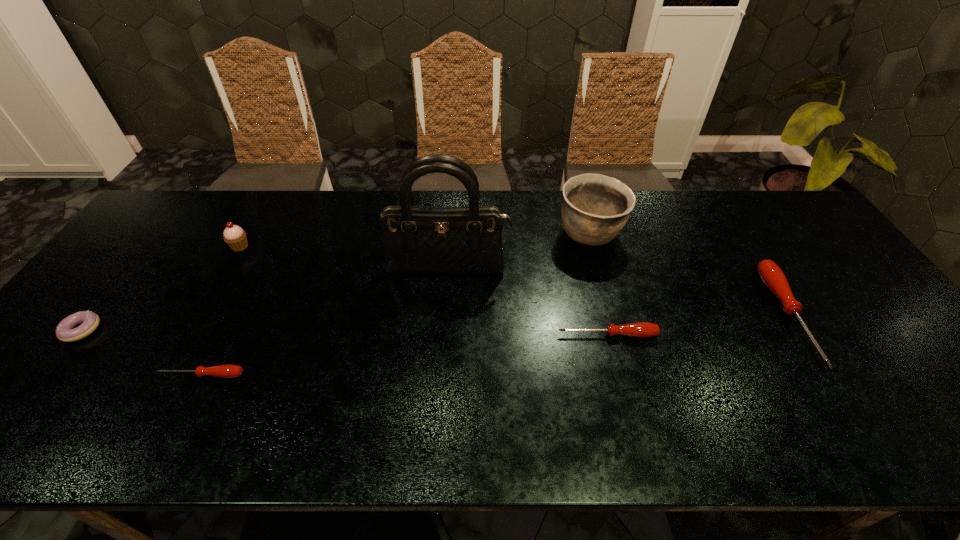
Locate an element on the screen. The width and height of the screenshot is (960, 540). free space located 0.400m on the back of the leftmost screwdriver is located at coordinates (262, 254).

Image resolution: width=960 pixels, height=540 pixels. Find the location of `vacant space located on the left of the second screwdriver from left to right`. vacant space located on the left of the second screwdriver from left to right is located at coordinates (419, 335).

Find the location of a particular element. vacant space located 0.080m on the left of the rightmost object is located at coordinates (748, 316).

Find the location of `free region located on the front of the cupcake`. free region located on the front of the cupcake is located at coordinates (192, 332).

Locate an element on the screen. Image resolution: width=960 pixels, height=540 pixels. vacant area located on the right of the pottery is located at coordinates pos(700,234).

Image resolution: width=960 pixels, height=540 pixels. In order to click on free space located 0.280m on the right of the leftmost object in this screenshot , I will do `click(209, 330)`.

Where is `free region located with an open clasp on the front of the fourth object from left to right`? Image resolution: width=960 pixels, height=540 pixels. free region located with an open clasp on the front of the fourth object from left to right is located at coordinates (444, 326).

Locate an element on the screen. object positioned at the far edge is located at coordinates (595, 208).

I want to click on object situated at the left edge, so click(90, 321).

This screenshot has height=540, width=960. Identify the location of vacant space at the far edge of the desktop. (268, 210).